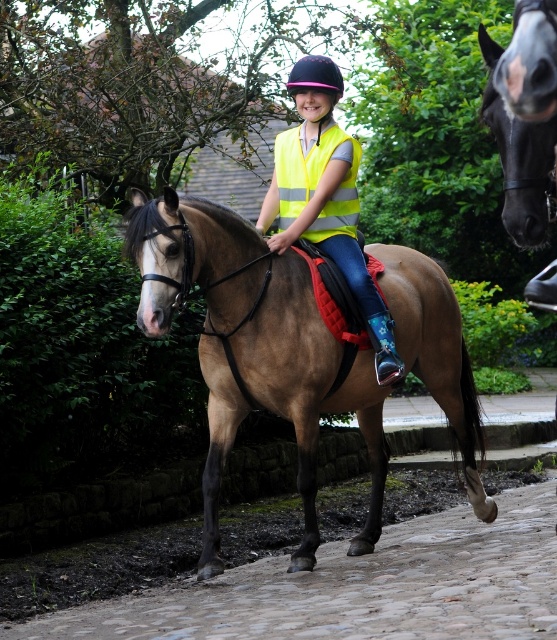
You are standing in the scene and want to move from point A to point B. Point A is at coordinates point (228,244) and point B is at coordinates point (289,225). Which point is closer to you?

Point (228,244) is closer to the viewer than point (289,225).

Consider the image. You are a photographer trying to capture the black glossy horse at upper center and the purple matte helmet at upper center in a single frame. Given that the horse is narrower than the helmet, which object should you adjust your camera angle to focus on to ensure both fit in the frame?

Since the black glossy horse at upper center is narrower than the purple matte helmet at upper center, you should adjust your camera angle to focus on the wider object, the purple matte helmet at upper center, to ensure both fit in the frame.